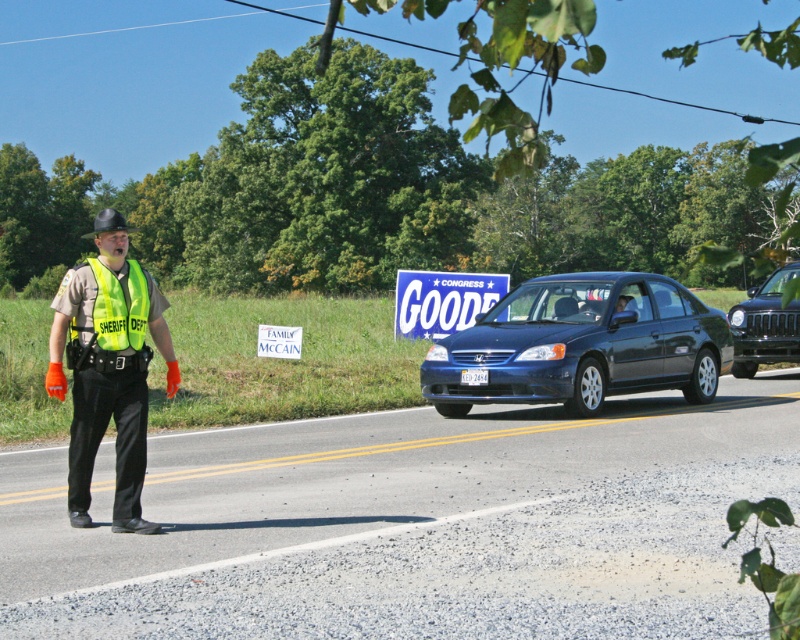
Is asphalt road at center positioned before blue fabric sign at center?

Yes, it is.

Does asphalt road at center have a greater width compared to blue fabric sign at center?

Yes.

At what (x,y) coordinates should I click in order to perform the action: click on asphalt road at center. Please return your answer as a coordinate pair (x, y). This screenshot has height=640, width=800. Looking at the image, I should click on (420, 525).

This screenshot has height=640, width=800. I want to click on asphalt road at center, so click(x=420, y=525).

Measure the distance from high-visibility reflective vest at left to reflective yellow vest at left.

high-visibility reflective vest at left and reflective yellow vest at left are 27.06 inches apart.

Is high-visibility reflective vest at left to the right of reflective yellow vest at left from the viewer's perspective?

In fact, high-visibility reflective vest at left is to the left of reflective yellow vest at left.

Who is more distant from viewer, (x=72, y=522) or (x=104, y=307)?

The point (x=72, y=522) is more distant.

Image resolution: width=800 pixels, height=640 pixels. In order to click on high-visibility reflective vest at left in this screenshot , I will do `click(108, 368)`.

Which is more to the left, asphalt road at center or shiny black car at right?

asphalt road at center is more to the left.

What do you see at coordinates (420, 525) in the screenshot?
I see `asphalt road at center` at bounding box center [420, 525].

Between point (548, 410) and point (766, 278), which one is positioned in front?

Point (548, 410) is in front.

This screenshot has height=640, width=800. What are the coordinates of `asphalt road at center` in the screenshot? It's located at (420, 525).